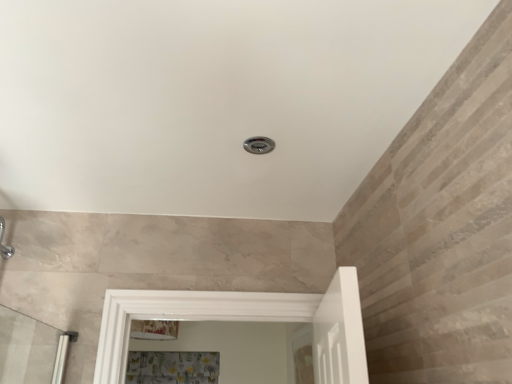
Question: Considering the relative sizes of clear glass screen door at center and floral fabric shower curtain at lower center in the image provided, is clear glass screen door at center taller than floral fabric shower curtain at lower center?

Choices:
 (A) yes
 (B) no

Answer: (A)

Question: From the image's perspective, would you say clear glass screen door at center is shown under floral fabric shower curtain at lower center?

Choices:
 (A) no
 (B) yes

Answer: (A)

Question: Considering the relative sizes of clear glass screen door at center and floral fabric shower curtain at lower center in the image provided, is clear glass screen door at center smaller than floral fabric shower curtain at lower center?

Choices:
 (A) yes
 (B) no

Answer: (A)

Question: Is clear glass screen door at center aimed at floral fabric shower curtain at lower center?

Choices:
 (A) no
 (B) yes

Answer: (B)

Question: Considering the relative positions of clear glass screen door at center and floral fabric shower curtain at lower center in the image provided, is clear glass screen door at center to the right of floral fabric shower curtain at lower center from the viewer's perspective?

Choices:
 (A) yes
 (B) no

Answer: (A)

Question: Is clear glass screen door at center spatially inside brushed metal shower at center, or outside of it?

Choices:
 (A) outside
 (B) inside

Answer: (A)

Question: Considering the positions of clear glass screen door at center and brushed metal shower at center in the image, is clear glass screen door at center bigger or smaller than brushed metal shower at center?

Choices:
 (A) small
 (B) big

Answer: (B)

Question: Considering the relative positions of clear glass screen door at center and brushed metal shower at center in the image provided, is clear glass screen door at center to the left or to the right of brushed metal shower at center?

Choices:
 (A) left
 (B) right

Answer: (B)

Question: Is clear glass screen door at center wider or thinner than brushed metal shower at center?

Choices:
 (A) thin
 (B) wide

Answer: (A)

Question: Considering the positions of brushed metal shower at center and clear glass screen door at center in the image, is brushed metal shower at center wider or thinner than clear glass screen door at center?

Choices:
 (A) wide
 (B) thin

Answer: (A)

Question: Do you think brushed metal shower at center is within clear glass screen door at center, or outside of it?

Choices:
 (A) outside
 (B) inside

Answer: (A)

Question: In terms of height, does brushed metal shower at center look taller or shorter compared to clear glass screen door at center?

Choices:
 (A) tall
 (B) short

Answer: (B)

Question: From the image's perspective, is brushed metal shower at center above or below clear glass screen door at center?

Choices:
 (A) below
 (B) above

Answer: (B)

Question: Does point (215, 357) appear closer or farther from the camera than point (291, 367)?

Choices:
 (A) farther
 (B) closer

Answer: (A)

Question: Choose the correct answer: Is floral fabric shower curtain at lower center inside clear glass screen door at center or outside it?

Choices:
 (A) outside
 (B) inside

Answer: (A)